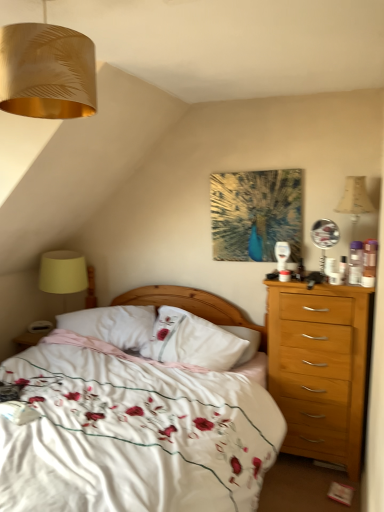
Question: From a real-world perspective, is yellow fabric lampshade at left positioned under white soft pillow at center, the 2th pillow when ordered from right to left, based on gravity?

Choices:
 (A) no
 (B) yes

Answer: (A)

Question: Does yellow fabric lampshade at left have a greater width compared to white soft pillow at center, the 2th pillow when ordered from right to left?

Choices:
 (A) no
 (B) yes

Answer: (A)

Question: Considering the relative sizes of yellow fabric lampshade at left and white soft pillow at center, the 2th pillow when ordered from right to left, in the image provided, is yellow fabric lampshade at left thinner than white soft pillow at center, the 2th pillow when ordered from right to left,?

Choices:
 (A) yes
 (B) no

Answer: (A)

Question: From the image's perspective, would you say yellow fabric lampshade at left is shown under white soft pillow at center, which is the 1th pillow from left to right?

Choices:
 (A) no
 (B) yes

Answer: (A)

Question: Can we say yellow fabric lampshade at left lies outside white soft pillow at center, the 2th pillow when ordered from right to left?

Choices:
 (A) no
 (B) yes

Answer: (B)

Question: From a real-world perspective, is yellow fabric lampshade at left on white soft pillow at center, the 2th pillow when ordered from right to left?

Choices:
 (A) yes
 (B) no

Answer: (A)

Question: Can you confirm if white soft pillow at center, the 2th pillow when ordered from right to left, is positioned to the right of white soft pillow at center, the first pillow from the right?

Choices:
 (A) no
 (B) yes

Answer: (A)

Question: Considering the relative sizes of white soft pillow at center, the 2th pillow when ordered from right to left, and white soft pillow at center, arranged as the second pillow when viewed from the left, in the image provided, is white soft pillow at center, the 2th pillow when ordered from right to left, thinner than white soft pillow at center, arranged as the second pillow when viewed from the left,?

Choices:
 (A) yes
 (B) no

Answer: (B)

Question: From the image's perspective, does white soft pillow at center, the 2th pillow when ordered from right to left, appear higher than white soft pillow at center, arranged as the second pillow when viewed from the left?

Choices:
 (A) yes
 (B) no

Answer: (B)

Question: Does white soft pillow at center, which is the 1th pillow from left to right, have a lesser height compared to white soft pillow at center, arranged as the second pillow when viewed from the left?

Choices:
 (A) no
 (B) yes

Answer: (B)

Question: Is white soft pillow at center, the 2th pillow when ordered from right to left, smaller than white soft pillow at center, arranged as the second pillow when viewed from the left?

Choices:
 (A) no
 (B) yes

Answer: (B)

Question: Is the depth of white soft pillow at center, which is the 1th pillow from left to right, less than that of white soft pillow at center, the first pillow from the right?

Choices:
 (A) yes
 (B) no

Answer: (B)

Question: Could you tell me if white soft pillow at center, which is the 1th pillow from left to right, is turned towards yellow fabric lampshade at left?

Choices:
 (A) yes
 (B) no

Answer: (B)